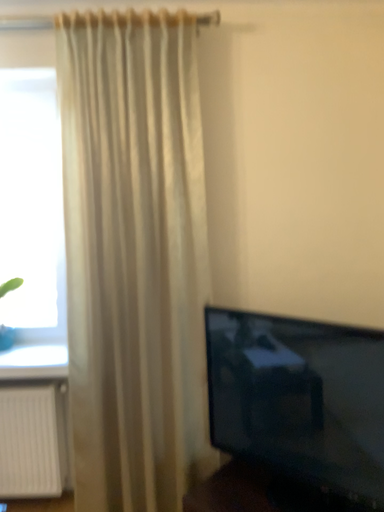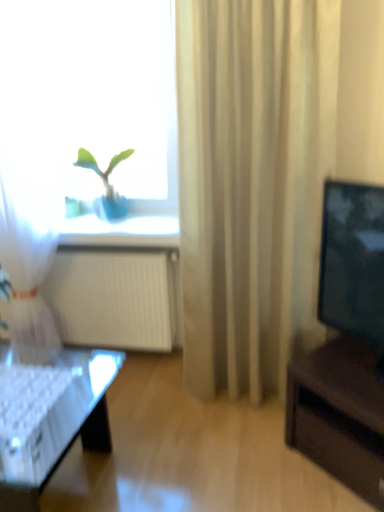
Question: How did the camera likely rotate when shooting the video?

Choices:
 (A) rotated upward
 (B) rotated downward

Answer: (B)